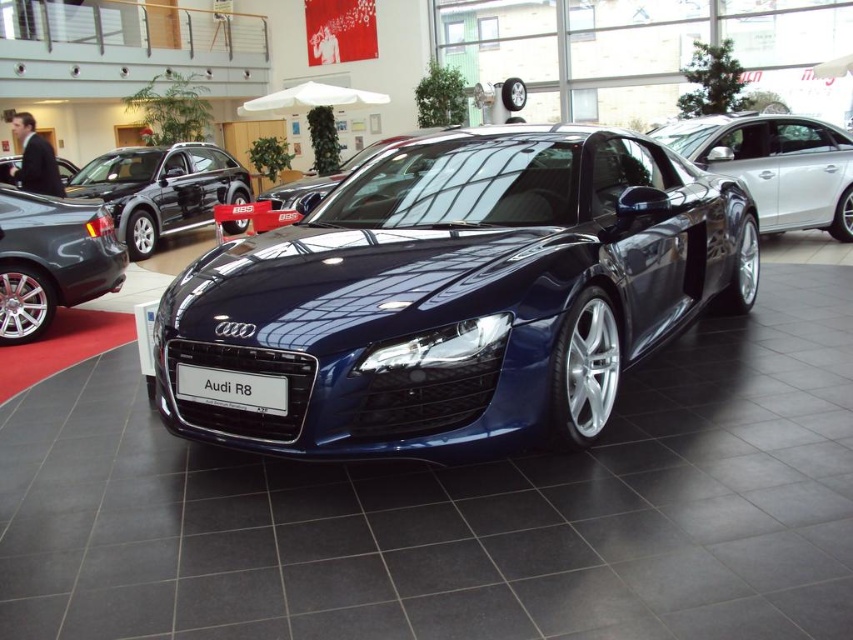
Question: Which object appears farthest from the camera in this image?

Choices:
 (A) white plastic license plate at center
 (B) shiny dark blue audi r8 at center
 (C) glossy black car at left

Answer: (C)

Question: Among these objects, which one is farthest from the camera?

Choices:
 (A) glossy black suv at upper left
 (B) shiny dark blue audi r8 at center
 (C) glossy black car at left
 (D) glossy metallic sedan at left

Answer: (C)

Question: Is glossy black suv at upper left above white plastic license plate at center?

Choices:
 (A) no
 (B) yes

Answer: (B)

Question: Which point is closer to the camera?

Choices:
 (A) (6, 163)
 (B) (96, 200)

Answer: (B)

Question: Where is shiny dark blue audi r8 at center located in relation to glossy black car at left in the image?

Choices:
 (A) right
 (B) left

Answer: (A)

Question: Can you confirm if glossy metallic sedan at left is positioned above white plastic license plate at center?

Choices:
 (A) no
 (B) yes

Answer: (B)